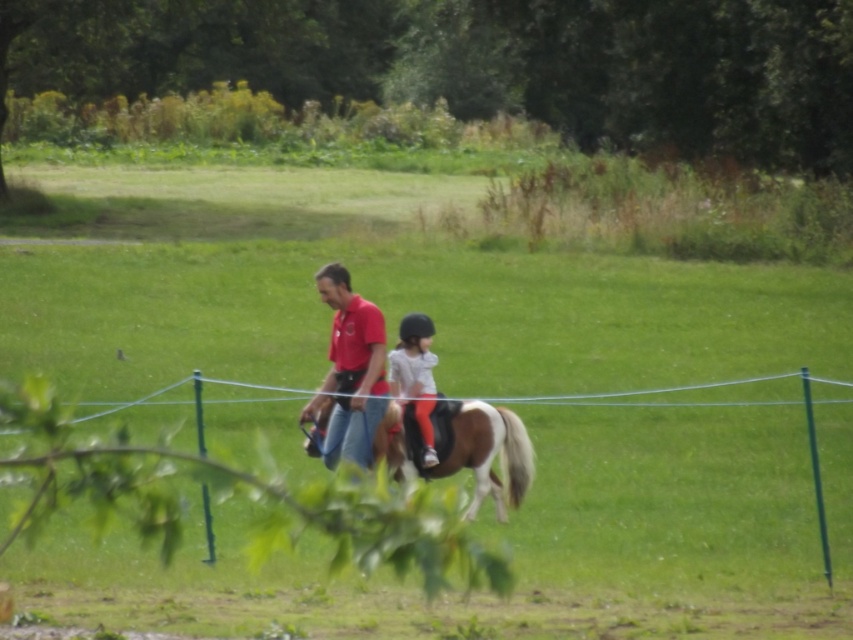
Can you confirm if blue wire fence at center is bigger than light gray fabric helmet at center?

Yes.

Identify the location of blue wire fence at center. (231, 492).

I want to click on blue wire fence at center, so click(x=231, y=492).

Can you confirm if blue wire fence at center is shorter than matte red shirt at center?

No.

Between blue wire fence at center and matte red shirt at center, which one is positioned lower?

Positioned lower is blue wire fence at center.

Does point (473, 572) come in front of point (374, 310)?

Yes, point (473, 572) is in front of point (374, 310).

Locate an element on the screen. The width and height of the screenshot is (853, 640). blue wire fence at center is located at coordinates (231, 492).

Between brown glossy horse at center and light gray fabric helmet at center, which one appears on the left side from the viewer's perspective?

Positioned to the left is light gray fabric helmet at center.

Who is more forward, (399, 445) or (434, 388)?

Point (399, 445) is more forward.

At what (x,y) coordinates should I click in order to perform the action: click on brown glossy horse at center. Please return your answer as a coordinate pair (x, y). Looking at the image, I should click on (489, 456).